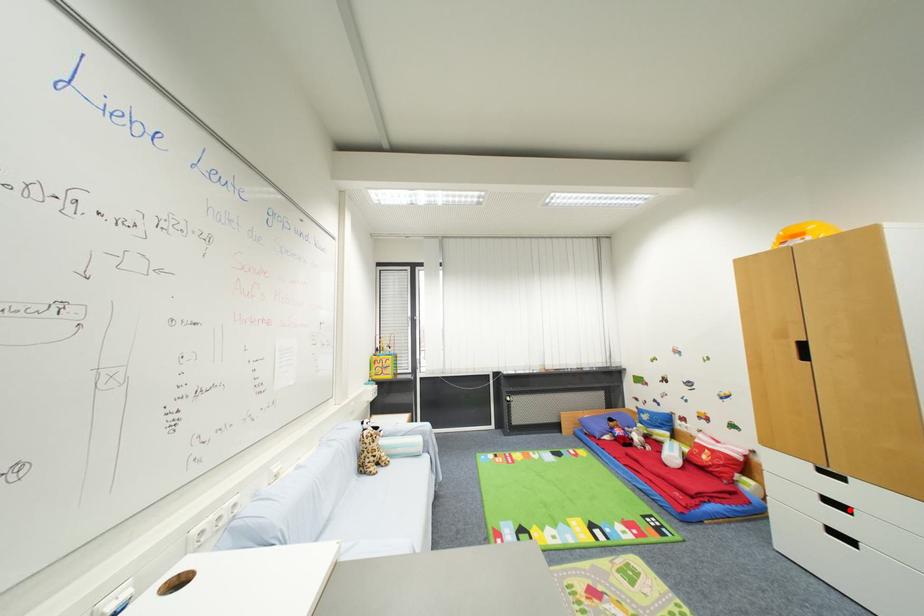
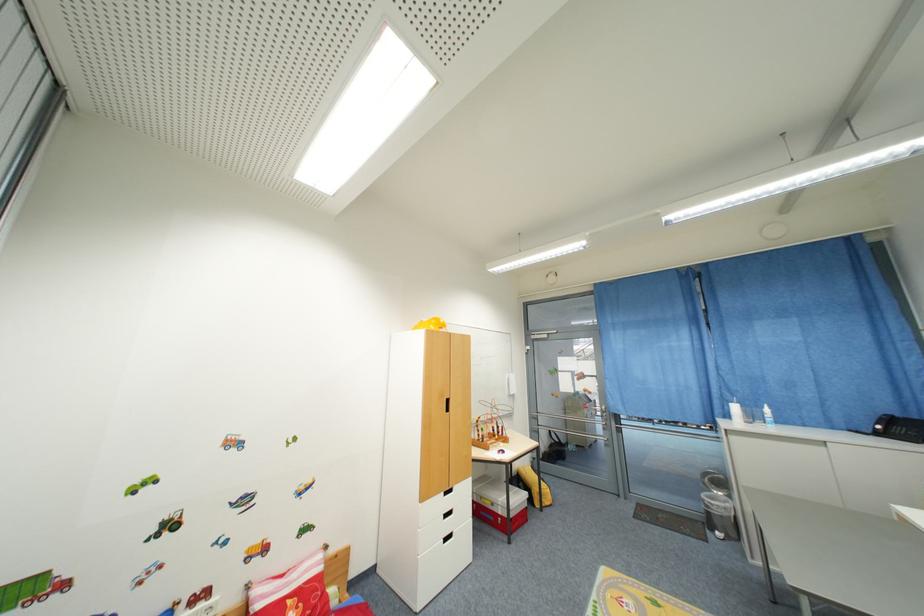
Where in the second image is the point corresponding to the highlighted location from the first image?

(458, 514)